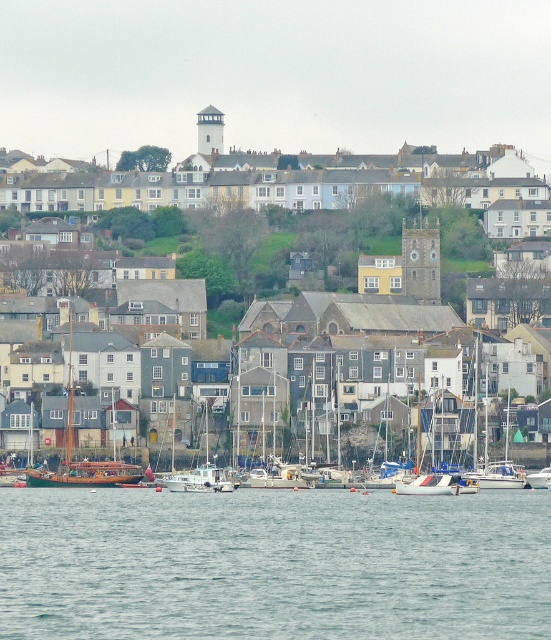
Question: Can you confirm if wooden sailboat at center is positioned to the left of white matte sailboat at center-right?

Choices:
 (A) no
 (B) yes

Answer: (B)

Question: Which of the following is the farthest from the observer?

Choices:
 (A) (114, 436)
 (B) (283, 545)
 (C) (407, 481)
 (D) (206, 481)

Answer: (A)

Question: Considering the real-world distances, which object is farthest from the clear water at lower center?

Choices:
 (A) wooden sailboat at center
 (B) white matte sailboat at center
 (C) white sailboat at center

Answer: (A)

Question: Based on their relative distances, which object is farther from the wooden sailboat at center?

Choices:
 (A) white matte sailboat at center-right
 (B) clear water at lower center
 (C) white sailboat at center

Answer: (B)

Question: Considering the relative positions of white matte buildings at center and white plastic boat at center in the image provided, where is white matte buildings at center located with respect to white plastic boat at center?

Choices:
 (A) right
 (B) left

Answer: (A)

Question: Considering the relative positions of white matte buildings at center and white sailboat at center in the image provided, where is white matte buildings at center located with respect to white sailboat at center?

Choices:
 (A) left
 (B) right

Answer: (A)